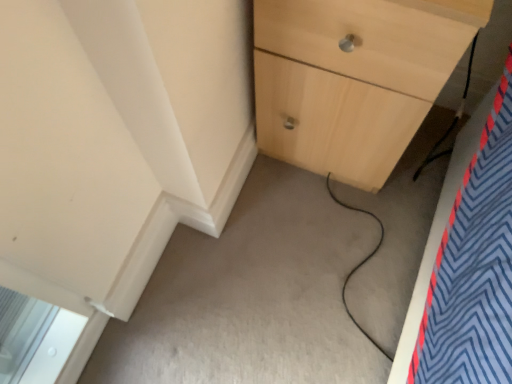
This screenshot has height=384, width=512. I want to click on light wood/texture chest of drawers at upper right, so click(x=354, y=78).

Image resolution: width=512 pixels, height=384 pixels. What do you see at coordinates (354, 78) in the screenshot?
I see `light wood/texture chest of drawers at upper right` at bounding box center [354, 78].

Image resolution: width=512 pixels, height=384 pixels. What are the coordinates of `light wood/texture chest of drawers at upper right` in the screenshot? It's located at (354, 78).